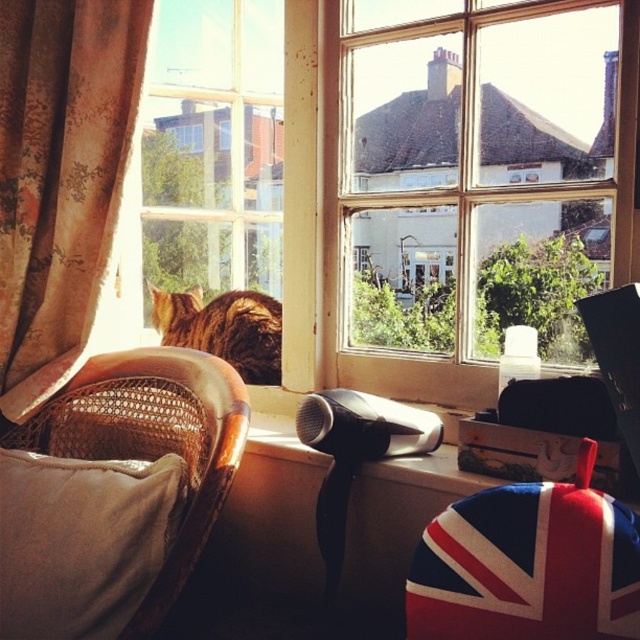
You are a guest in this room and want to sit on the beige fabric pillow at lower left. However, there is a golden fur cat at left on the windowsill. Which object is closer to the left edge of the image?

The beige fabric pillow at lower left is positioned on the left side of golden fur cat at left, so the beige fabric pillow at lower left is closer to the left edge of the image.